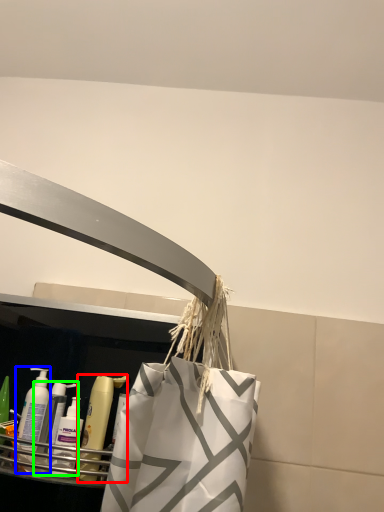
Question: Which object is positioned farthest from mouthwash (highlighted by a red box)? Select from cleaning product (highlighted by a blue box) and cleaning product (highlighted by a green box).

Choices:
 (A) cleaning product
 (B) cleaning product

Answer: (A)